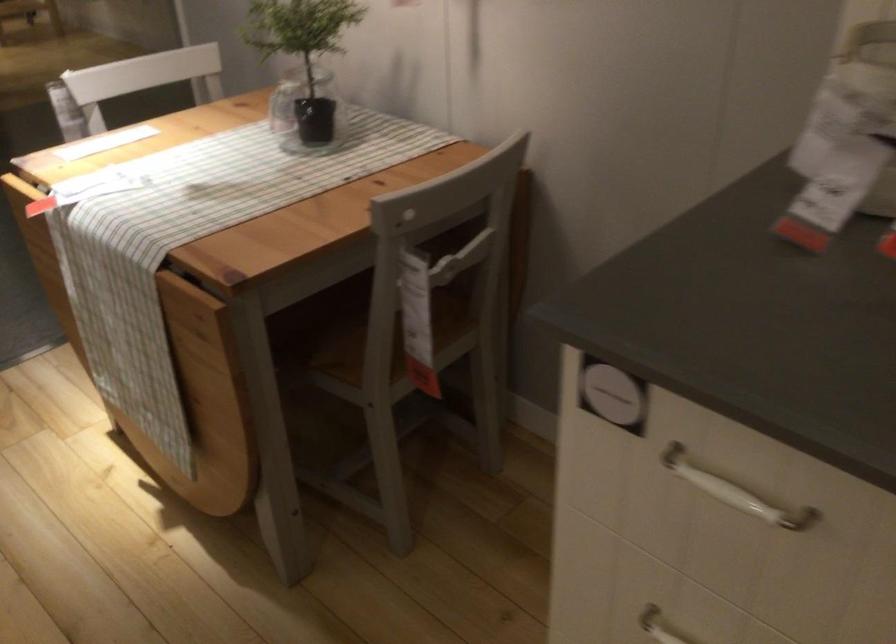
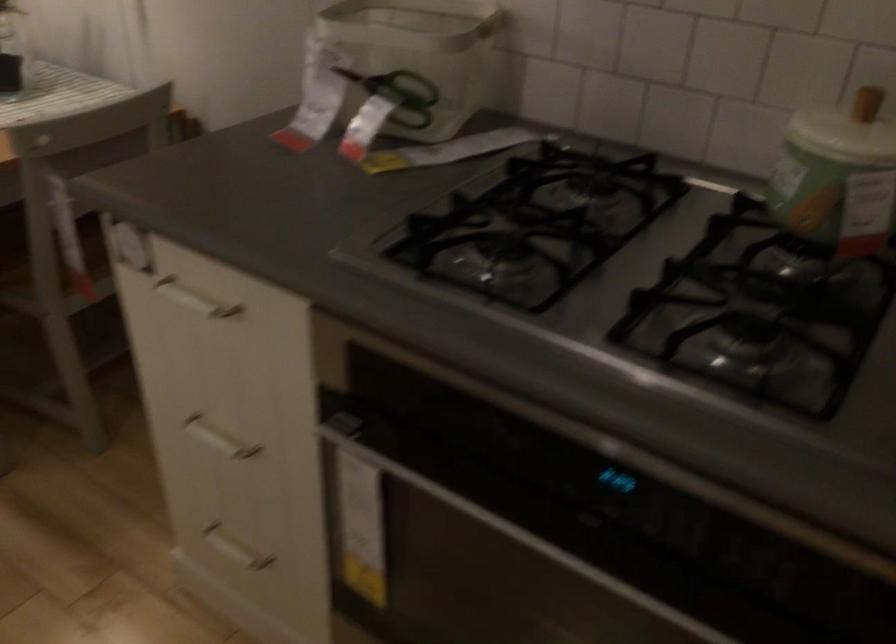
In the second image, find the point that corresponds to point (391, 359) in the first image.

(54, 270)